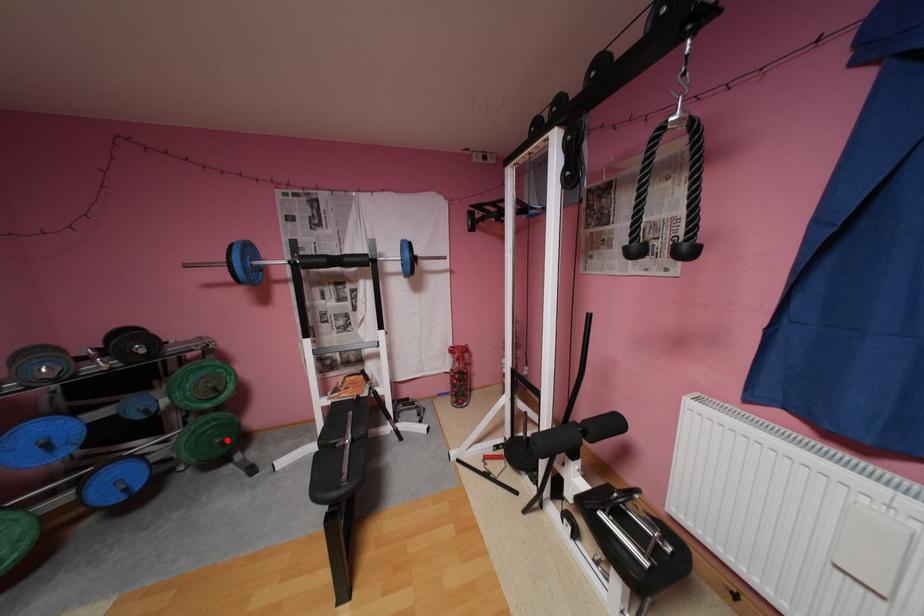
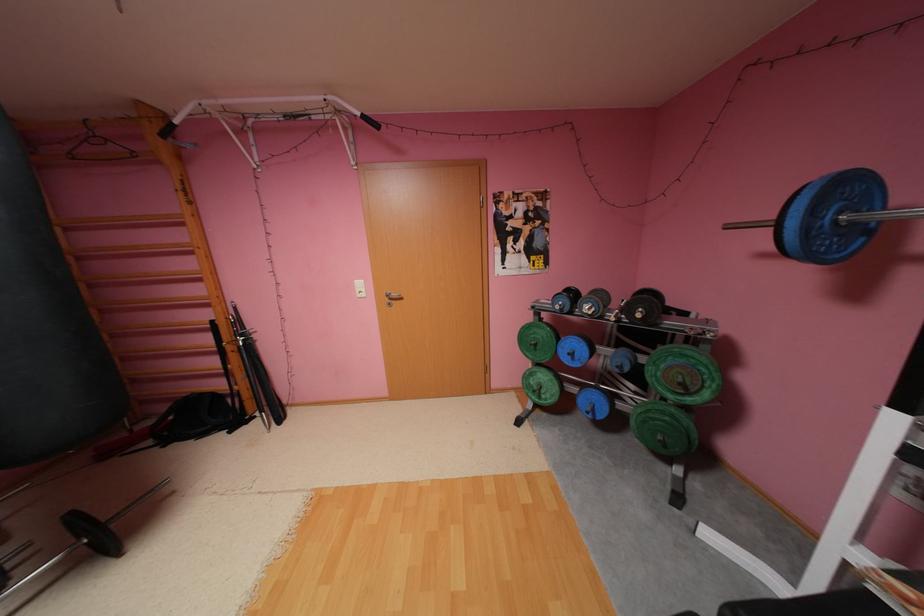
Find the pixel in the second image that matches the highlighted location in the first image.

(669, 438)